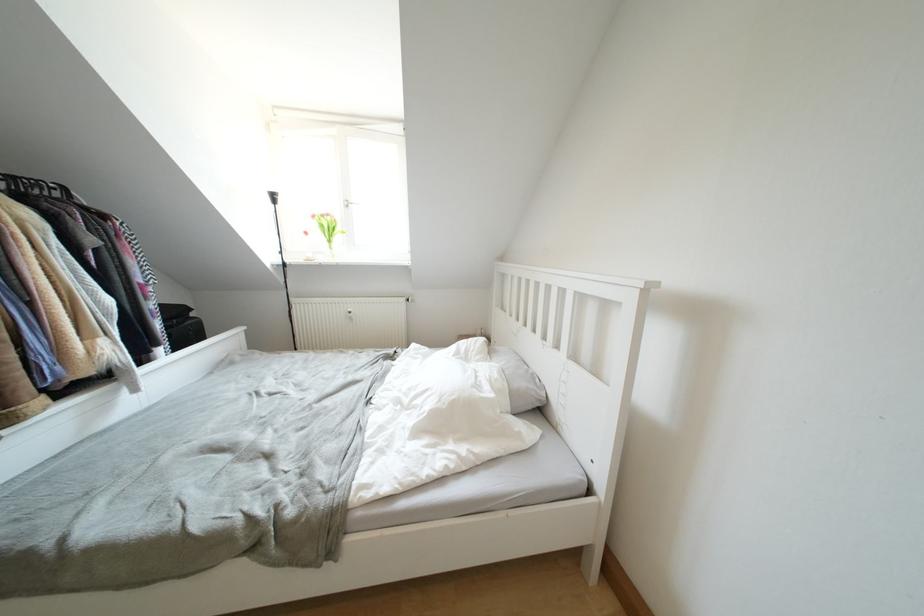
Find where to pull the white window handle. Please return your answer as a coordinate pair (x, y).

(349, 203)